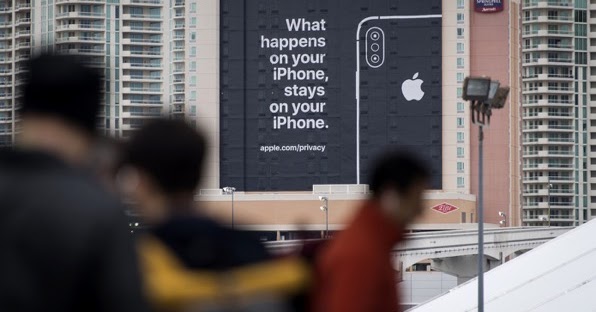
Where is `black wall`? This screenshot has width=596, height=312. black wall is located at coordinates (344, 84).